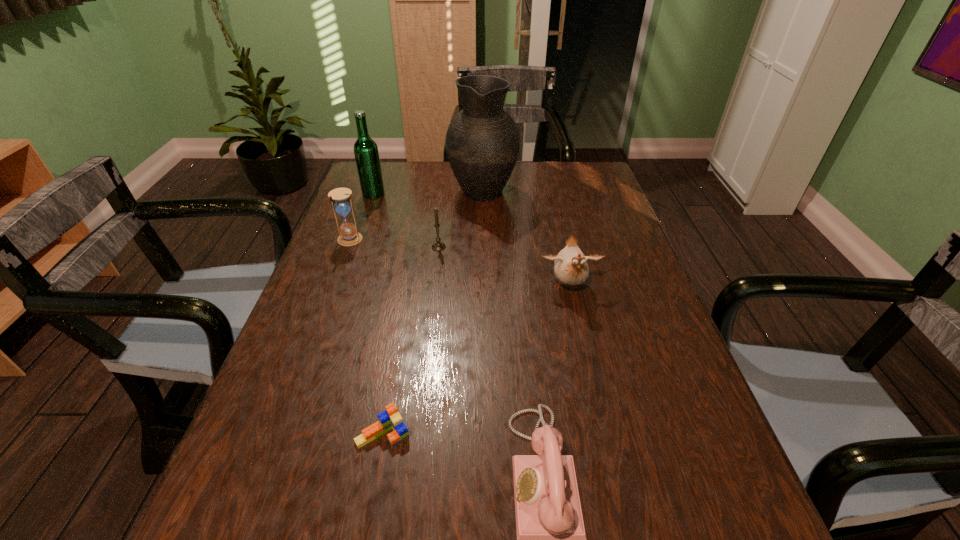
Where is `object identified as the fourth closest to the candle`? object identified as the fourth closest to the candle is located at coordinates (366, 153).

The width and height of the screenshot is (960, 540). Find the location of `free space that satisfies the following two spatial constraints: 1. on the front side of the candle; 2. on the left side of the hourglass`. free space that satisfies the following two spatial constraints: 1. on the front side of the candle; 2. on the left side of the hourglass is located at coordinates (347, 247).

The image size is (960, 540). In order to click on free spot that satisfies the following two spatial constraints: 1. on the front side of the Lego; 2. on the left side of the hourglass in this screenshot , I will do pos(277,433).